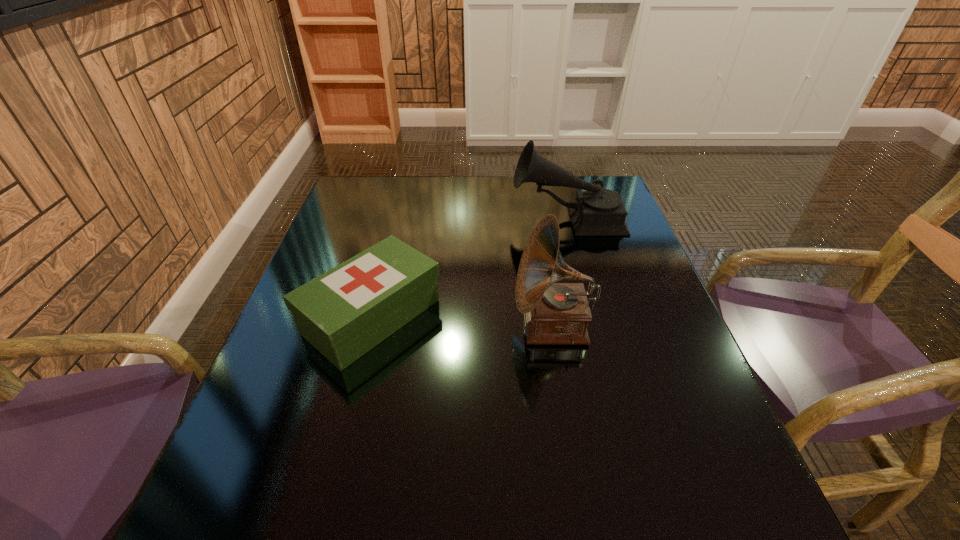
Identify the location of vacant space that's between the first-aid kit and the nearer phonograph_record. The width and height of the screenshot is (960, 540). (463, 321).

At what (x,y) coordinates should I click in order to perform the action: click on vacant space in between the nearer phonograph_record and the first-aid kit. Please return your answer as a coordinate pair (x, y). This screenshot has width=960, height=540. Looking at the image, I should click on (463, 321).

In order to click on vacant space that's between the nearer phonograph_record and the first-aid kit in this screenshot , I will do tap(463, 321).

You are a GUI agent. You are given a task and a screenshot of the screen. Output one action in this format:
    pyautogui.click(x=<x>, y=<y>)
    Task: Click on the free space between the nearer phonograph_record and the leftmost object
    The width and height of the screenshot is (960, 540).
    Given the screenshot: What is the action you would take?
    pyautogui.click(x=463, y=321)

Identify which object is the second nearest to the nearer phonograph_record. Please provide its 2D coordinates. Your answer should be formatted as a tuple, i.e. [(x, y)], where the tuple contains the x and y coordinates of a point satisfying the conditions above.

[(597, 211)]

Where is `the second closest object relative to the nearer phonograph_record`? The image size is (960, 540). the second closest object relative to the nearer phonograph_record is located at coordinates (597, 211).

Find the location of a particular element. The width and height of the screenshot is (960, 540). blank area in the image that satisfies the following two spatial constraints: 1. from the horn of the farther phonograph_record; 2. on the front side of the first-aid kit is located at coordinates (593, 316).